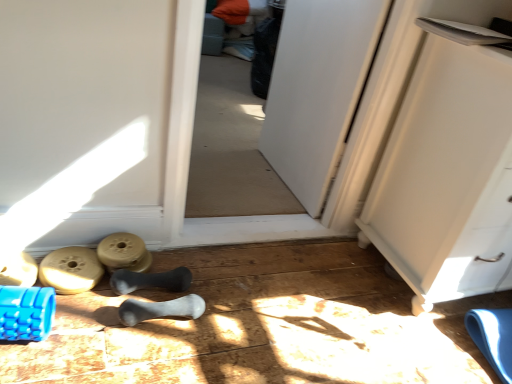
Locate an element on the screen. The width and height of the screenshot is (512, 384). vacant space in front of matte rubber dumbbell at lower left, the 2th footwear when ordered from left to right is located at coordinates (69, 326).